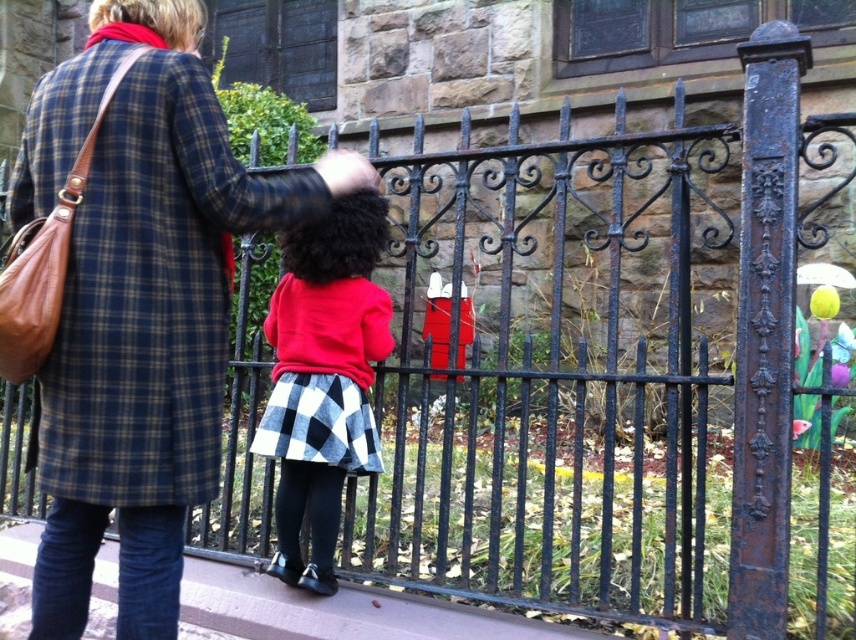
Question: Is plaid wool coat at upper left bigger than red wool sweater at center?

Choices:
 (A) no
 (B) yes

Answer: (B)

Question: Among these objects, which one is farthest from the camera?

Choices:
 (A) plaid wool coat at upper left
 (B) red wool sweater at center

Answer: (B)

Question: Which object appears farthest from the camera in this image?

Choices:
 (A) plaid wool coat at upper left
 (B) red wool sweater at center

Answer: (B)

Question: Does plaid wool coat at upper left have a smaller size compared to red wool sweater at center?

Choices:
 (A) no
 (B) yes

Answer: (A)

Question: Does plaid wool coat at upper left have a lesser width compared to red wool sweater at center?

Choices:
 (A) no
 (B) yes

Answer: (A)

Question: Which point appears farthest from the camera in this image?

Choices:
 (A) (286, 508)
 (B) (146, 282)

Answer: (A)